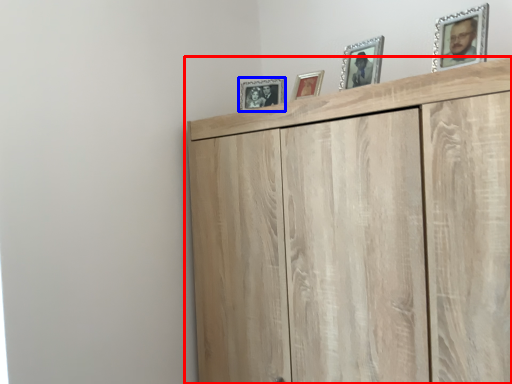
Question: Which point is further to the camera, cupboard (highlighted by a red box) or picture frame (highlighted by a blue box)?

Choices:
 (A) cupboard
 (B) picture frame

Answer: (B)